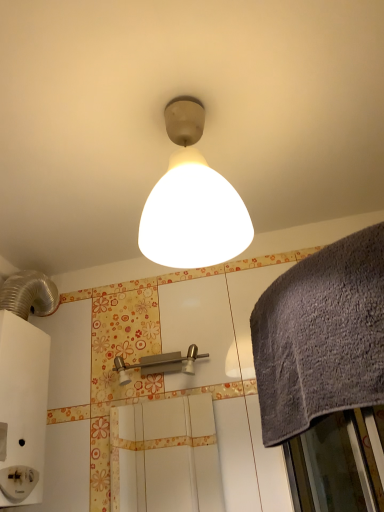
Identify the location of brushed metal shower at center. (160, 364).

Where is `matte white lampshade at center`? matte white lampshade at center is located at coordinates (192, 202).

The image size is (384, 512). What are the coordinates of `white matte screen door at center` in the screenshot? It's located at (165, 456).

Considering the sizes of objects matte white lampshade at center and white matte screen door at center in the image provided, who is taller, matte white lampshade at center or white matte screen door at center?

matte white lampshade at center is taller.

Which point is more forward, [188,211] or [178,437]?

The point [188,211] is in front.

From the image's perspective, which one is positioned lower, matte white lampshade at center or white matte screen door at center?

white matte screen door at center, from the image's perspective.

Is matte white lampshade at center turned away from white matte screen door at center?

No.

Is gray textured towel at right taller than matte white lampshade at center?

Incorrect, the height of gray textured towel at right is not larger of that of matte white lampshade at center.

Is point (300, 284) behind point (239, 220)?

No, (300, 284) is closer to viewer.

There is a gray textured towel at right. What are the coordinates of `lamp above it (from a real-world perspective)` in the screenshot? It's located at (192, 202).

Does gray textured towel at right turn towards matte white lampshade at center?

No, gray textured towel at right is not turned towards matte white lampshade at center.

Which of these two, white matte screen door at center or brushed metal shower at center, is bigger?

brushed metal shower at center.

Is white matte screen door at center not inside brushed metal shower at center?

Yes, white matte screen door at center is not within brushed metal shower at center.

Considering the positions of point (149, 445) and point (127, 368), is point (149, 445) closer or farther from the camera than point (127, 368)?

Clearly, point (149, 445) is more distant from the camera than point (127, 368).

Is white matte screen door at center not near brushed metal shower at center?

Yes, white matte screen door at center is far from brushed metal shower at center.

Can you tell me how much brushed metal shower at center and gray textured towel at right differ in facing direction?

42.6 degrees.

From a real-world perspective, between brushed metal shower at center and gray textured towel at right, who is vertically higher?

In real-world perspective, brushed metal shower at center is above.

Is brushed metal shower at center taller than gray textured towel at right?

No.

Considering the positions of objects brushed metal shower at center and gray textured towel at right in the image provided, who is behind, brushed metal shower at center or gray textured towel at right?

brushed metal shower at center is further away from the camera.

Which of these two, gray textured towel at right or white matte screen door at center, is smaller?

Smaller between the two is white matte screen door at center.

Is gray textured towel at right positioned beyond the bounds of white matte screen door at center?

gray textured towel at right lies outside white matte screen door at center's area.

In the scene shown: Is gray textured towel at right taller than white matte screen door at center?

Indeed, gray textured towel at right has a greater height compared to white matte screen door at center.

From the image's perspective, relative to white matte screen door at center, is gray textured towel at right above or below?

gray textured towel at right is situated higher than white matte screen door at center in the image.

Based on the photo, is brushed metal shower at center positioned beyond the bounds of matte white lampshade at center?

That's correct, brushed metal shower at center is outside of matte white lampshade at center.

Which of these two, brushed metal shower at center or matte white lampshade at center, is wider?

matte white lampshade at center is wider.

Considering the sizes of objects brushed metal shower at center and matte white lampshade at center in the image provided, who is shorter, brushed metal shower at center or matte white lampshade at center?

Standing shorter between the two is brushed metal shower at center.

Is white matte screen door at center at the right side of matte white lampshade at center?

No.

Is white matte screen door at center turned away from matte white lampshade at center?

No.

Is white matte screen door at center not within matte white lampshade at center?

That's correct, white matte screen door at center is outside of matte white lampshade at center.

Where is `lamp in front of the white matte screen door at center`? The width and height of the screenshot is (384, 512). lamp in front of the white matte screen door at center is located at coordinates (192, 202).

In the image, there is a matte white lampshade at center. Identify the location of bath towel below it (from the image's perspective). This screenshot has width=384, height=512. (321, 336).

Which object lies further to the anchor point white matte screen door at center, matte white lampshade at center or brushed metal shower at center?

The object further to white matte screen door at center is matte white lampshade at center.

Looking at the image, which one is located closer to matte white lampshade at center, brushed metal shower at center or white matte screen door at center?

Among the two, brushed metal shower at center is located nearer to matte white lampshade at center.

Which object lies nearer to the anchor point brushed metal shower at center, white matte screen door at center or matte white lampshade at center?

matte white lampshade at center is closer to brushed metal shower at center.

In the scene shown: From the image, which object appears to be nearer to gray textured towel at right, matte white lampshade at center or brushed metal shower at center?

matte white lampshade at center is positioned closer to the anchor gray textured towel at right.

Estimate the real-world distances between objects in this image. Which object is closer to brushed metal shower at center, white matte screen door at center or gray textured towel at right?

gray textured towel at right is positioned closer to the anchor brushed metal shower at center.

When comparing their distances from brushed metal shower at center, does matte white lampshade at center or white matte screen door at center seem further?

white matte screen door at center is positioned further to the anchor brushed metal shower at center.

Based on their spatial positions, is gray textured towel at right or white matte screen door at center further from matte white lampshade at center?

white matte screen door at center is positioned further to the anchor matte white lampshade at center.

Estimate the real-world distances between objects in this image. Which object is closer to gray textured towel at right, brushed metal shower at center or matte white lampshade at center?

matte white lampshade at center lies closer to gray textured towel at right than the other object.

Where is `shower between matte white lampshade at center and white matte screen door at center from top to bottom`? The height and width of the screenshot is (512, 384). shower between matte white lampshade at center and white matte screen door at center from top to bottom is located at coordinates (160, 364).

At what (x,y) coordinates should I click in order to perform the action: click on screen door located between gray textured towel at right and brushed metal shower at center in the depth direction. Please return your answer as a coordinate pair (x, y). The width and height of the screenshot is (384, 512). Looking at the image, I should click on (165, 456).

The image size is (384, 512). What are the coordinates of `lamp between gray textured towel at right and brushed metal shower at center along the z-axis` in the screenshot? It's located at (192, 202).

Locate an element on the screen. This screenshot has height=512, width=384. bath towel between matte white lampshade at center and white matte screen door at center from top to bottom is located at coordinates (321, 336).